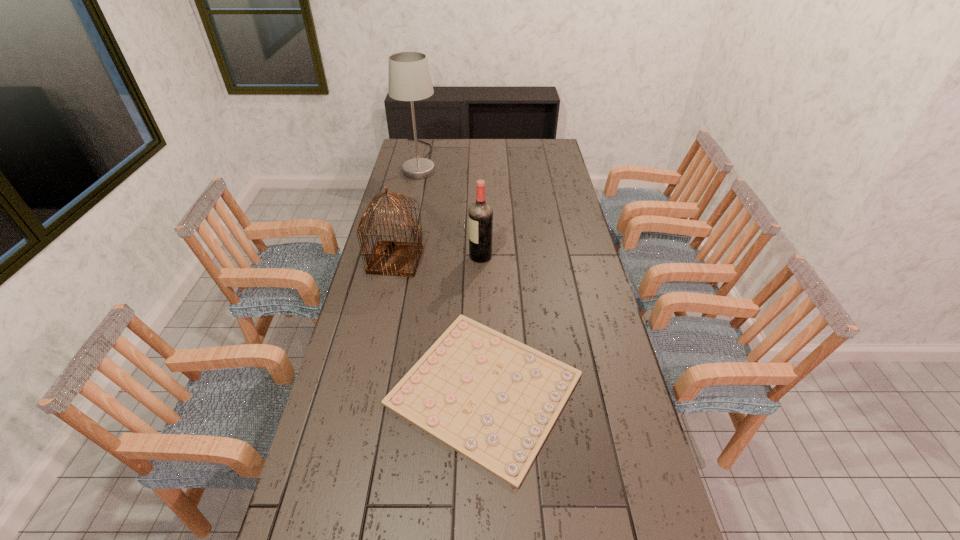
The width and height of the screenshot is (960, 540). I want to click on object that is the second closest to the birdcage, so pyautogui.click(x=493, y=399).

Identify which object is the nearest to the birdcage. Please provide its 2D coordinates. Your answer should be formatted as a tuple, i.e. [(x, y)], where the tuple contains the x and y coordinates of a point satisfying the conditions above.

[(480, 215)]

In order to click on free space that satisfies the following two spatial constraints: 1. on the front side of the gameboard; 2. on the left side of the tallest object in this screenshot , I will do `click(373, 389)`.

The image size is (960, 540). Find the location of `vacant region that satisfies the following two spatial constraints: 1. on the back side of the tallest object; 2. on the left side of the birdcage`. vacant region that satisfies the following two spatial constraints: 1. on the back side of the tallest object; 2. on the left side of the birdcage is located at coordinates (x=418, y=159).

At what (x,y) coordinates should I click in order to perform the action: click on free location that satisfies the following two spatial constraints: 1. on the front-facing side of the liquor; 2. on the back side of the shortest object. Please return your answer as a coordinate pair (x, y). Looking at the image, I should click on (481, 389).

Locate an element on the screen. vacant region that satisfies the following two spatial constraints: 1. on the front-facing side of the liquor; 2. on the back side of the gameboard is located at coordinates (481, 389).